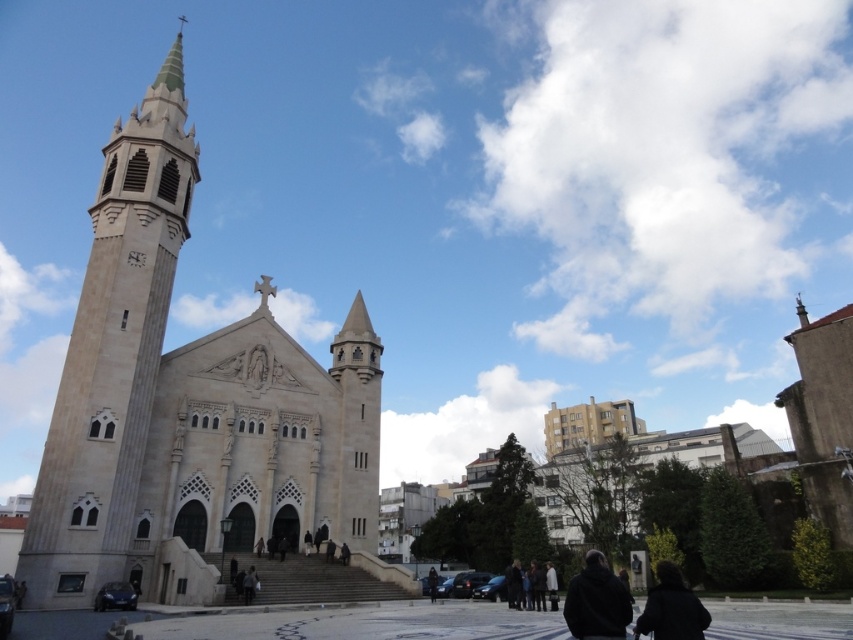
Image resolution: width=853 pixels, height=640 pixels. Describe the element at coordinates (189, 404) in the screenshot. I see `beige stone church at left` at that location.

Is beige stone church at left below black matte jacket at lower center?

No, beige stone church at left is not below black matte jacket at lower center.

Find the location of a particular element. The image size is (853, 640). beige stone church at left is located at coordinates (189, 404).

Is light beige stone tower at left taller than black matte jacket at lower right?

Correct, light beige stone tower at left is much taller as black matte jacket at lower right.

Is point (113, 157) more distant than point (583, 620)?

That is True.

Image resolution: width=853 pixels, height=640 pixels. In order to click on light beige stone tower at left in this screenshot , I will do `click(112, 352)`.

Which is in front, point (242, 403) or point (120, 259)?

Positioned in front is point (120, 259).

Between beige stone church at left and light beige stone tower at left, which one is positioned lower?

beige stone church at left is below.

Who is more forward, (135,272) or (170,67)?

Point (135,272) is more forward.

The width and height of the screenshot is (853, 640). What are the coordinates of `beige stone church at left` in the screenshot? It's located at (189, 404).